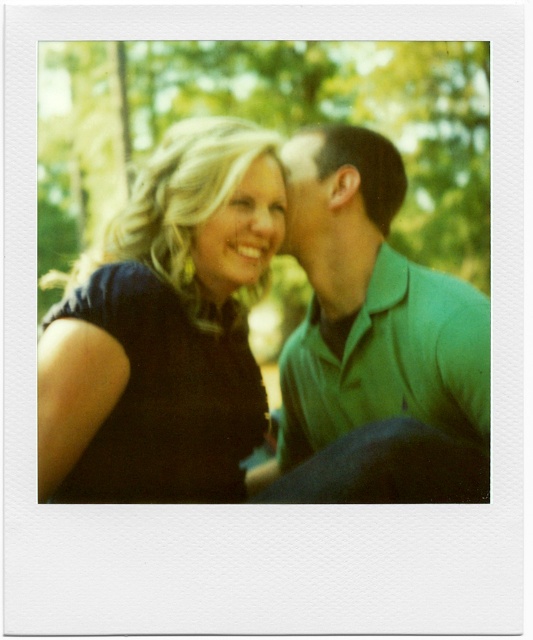
You are designing a layout for a magazine cover and need to place a photo of two people. The photo must fit within a 4x6 inch frame. Given the description of the matte black hair at center and the matte green shirt at upper right, which object would you prioritize to ensure it fits within the frame?

The matte black hair at center should be prioritized because its width surpasses that of the matte green shirt at upper right, ensuring the wider object is accommodated first within the frame.

You are standing in front of a Polaroid photo and notice two points marked on it. The first point is at coordinates point (x=204, y=234) and the second is at point (x=303, y=234). Which point is closer to you?

Point (x=204, y=234) is in front of point (x=303, y=234), so it is closer to you.

In this Polaroid photo, there are a black matte dress at upper left and a matte black hair at center. Which one is positioned more to the left side?

The black matte dress at upper left is positioned more to the left side than the matte black hair at center.